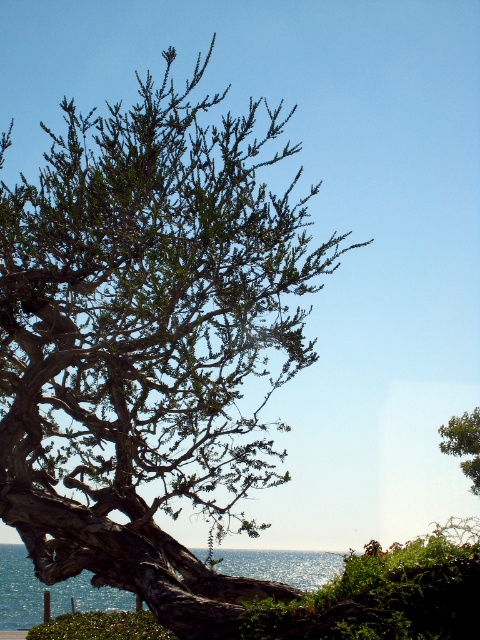
Is blue reflective water at lower left to the right of green leafy tree at upper right from the viewer's perspective?

No, blue reflective water at lower left is not to the right of green leafy tree at upper right.

Is point (101, 586) less distant than point (448, 442)?

Yes, point (101, 586) is in front of point (448, 442).

You are a GUI agent. You are given a task and a screenshot of the screen. Output one action in this format:
    pyautogui.click(x=<x>, y=<y>)
    Task: Click on the blue reflective water at lower left
    The image size is (480, 640).
    Given the screenshot: What is the action you would take?
    pyautogui.click(x=50, y=593)

Between green leafy tree at center and blue reflective water at lower left, which one is positioned lower?

Positioned lower is blue reflective water at lower left.

Can you confirm if green leafy tree at center is taller than blue reflective water at lower left?

Yes, green leafy tree at center is taller than blue reflective water at lower left.

Identify the location of green leafy tree at center. This screenshot has height=640, width=480. (149, 344).

Where is `green leafy tree at center`? green leafy tree at center is located at coordinates (149, 344).

Can you confirm if green leafy tree at center is positioned below green leafy tree at upper right?

No, green leafy tree at center is not below green leafy tree at upper right.

Which is behind, point (177, 451) or point (467, 460)?

Positioned behind is point (467, 460).

Describe the element at coordinates (149, 344) in the screenshot. I see `green leafy tree at center` at that location.

Where is `green leafy tree at center`? green leafy tree at center is located at coordinates (149, 344).